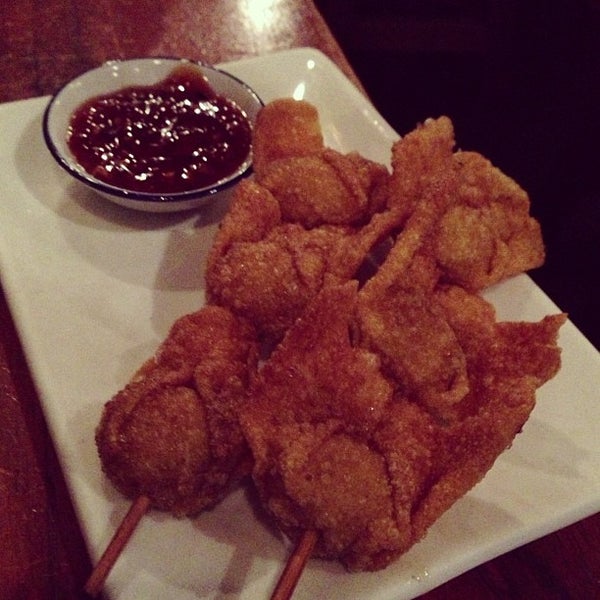
Identify the location of inner edge of white bowl. The height and width of the screenshot is (600, 600). (107, 76).